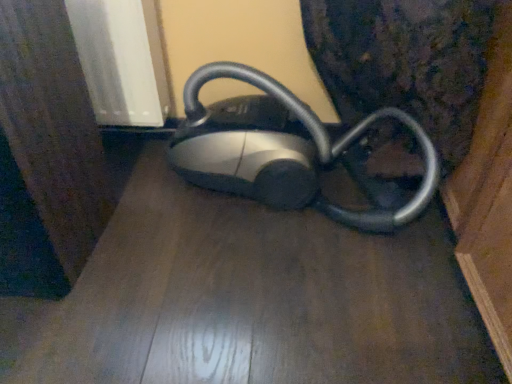
Locate an element on the screen. free space underneath silver metallic vacuum cleaner at center (from a real-world perspective) is located at coordinates (283, 208).